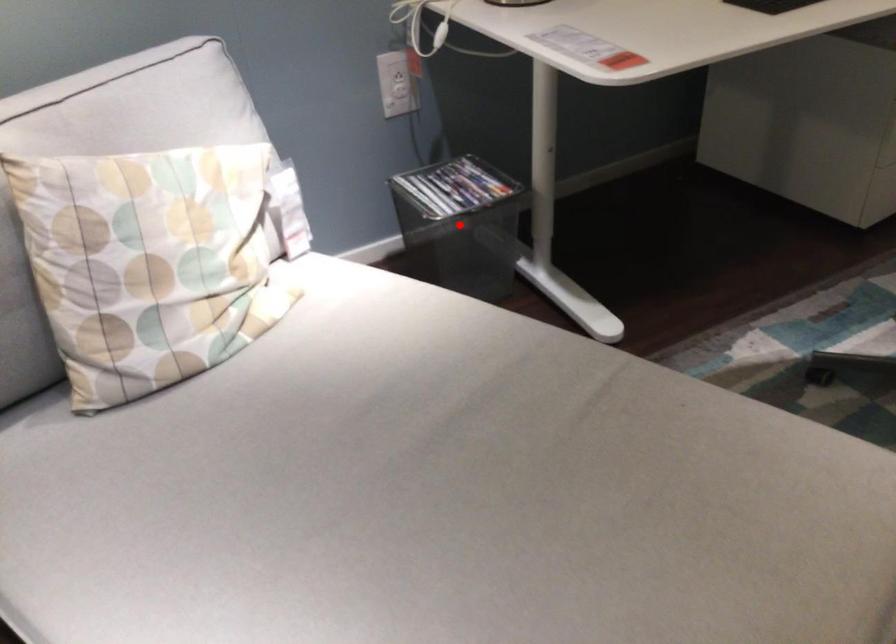
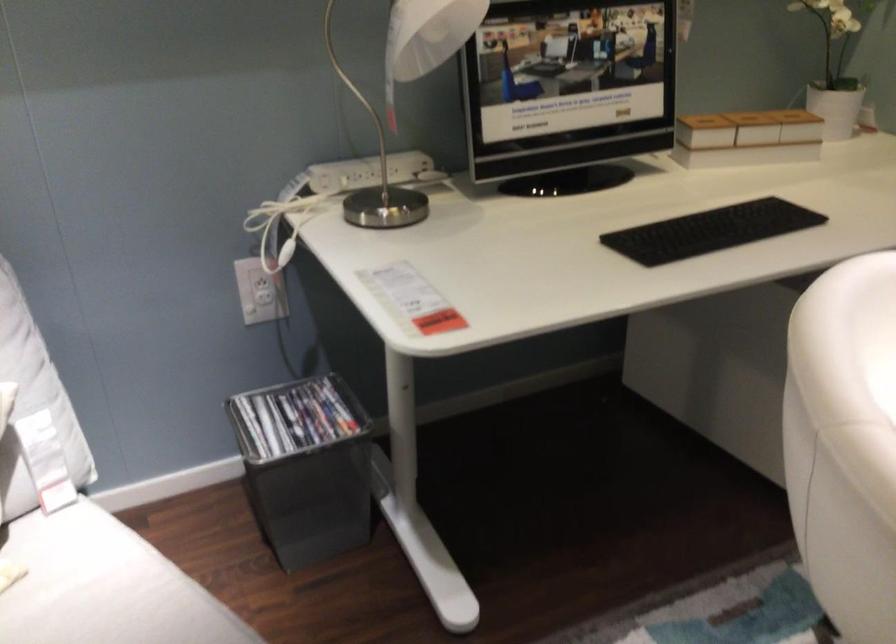
Question: I am providing you with two images of the same scene from different viewpoints. In image1, a red point is highlighted. Considering the same 3D point in image2, which of the following is correct?

Choices:
 (A) It is closer
 (B) It is farther

Answer: (A)